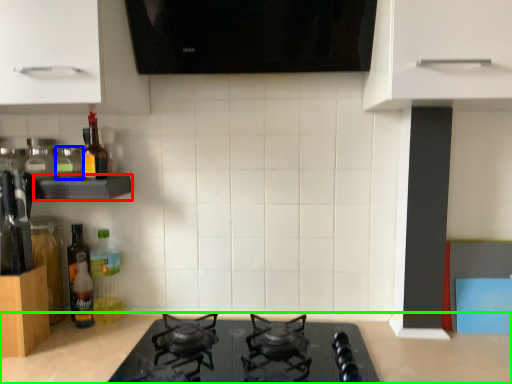
Question: Considering the real-world distances, which object is farthest from shelf (highlighted by a red box)? bottle (highlighted by a blue box) or countertop (highlighted by a green box)?

Choices:
 (A) bottle
 (B) countertop

Answer: (B)